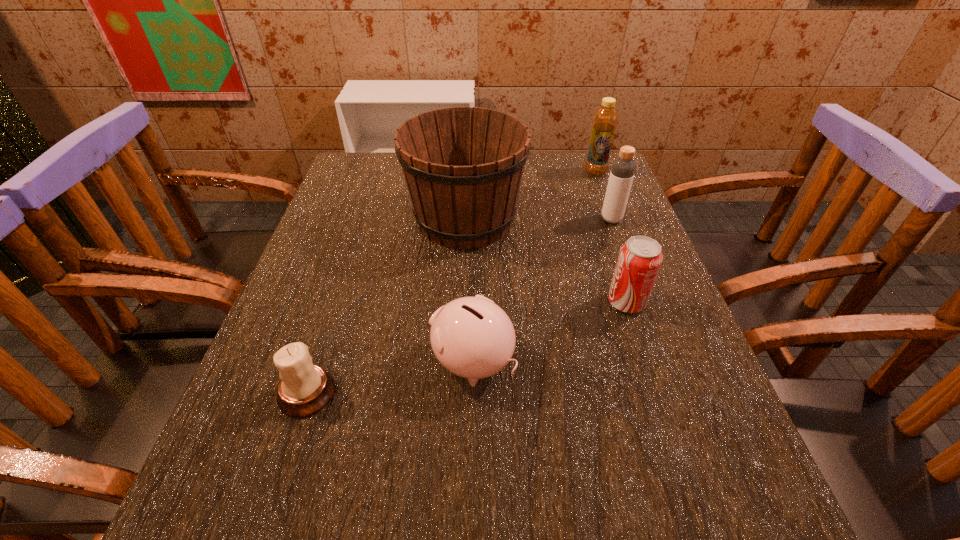
At what (x,y) coordinates should I click in order to perform the action: click on wine bucket. Please return your answer as a coordinate pair (x, y). The height and width of the screenshot is (540, 960). Looking at the image, I should click on (463, 166).

Locate an element on the screen. The height and width of the screenshot is (540, 960). the farther bottle is located at coordinates (605, 119).

You are a GUI agent. You are given a task and a screenshot of the screen. Output one action in this format:
    pyautogui.click(x=<x>, y=<y>)
    Task: Click on the nearer bottle
    The width and height of the screenshot is (960, 540).
    Given the screenshot: What is the action you would take?
    pyautogui.click(x=623, y=168)

The width and height of the screenshot is (960, 540). In order to click on soda can in this screenshot , I will do `click(640, 258)`.

Where is `piggy bank`? The image size is (960, 540). piggy bank is located at coordinates (472, 337).

At what (x,y) coordinates should I click in order to perform the action: click on candle holder. Please return your answer as a coordinate pair (x, y). The height and width of the screenshot is (540, 960). Looking at the image, I should click on (304, 389).

Locate an element on the screen. This screenshot has height=540, width=960. free point located on the right of the wine bucket is located at coordinates coord(630,219).

You are a GUI agent. You are given a task and a screenshot of the screen. Output one action in this format:
    pyautogui.click(x=<x>, y=<y>)
    Task: Click on the blank area located 0.090m on the back of the farther bottle
    Image resolution: width=960 pixels, height=540 pixels.
    Given the screenshot: What is the action you would take?
    pyautogui.click(x=588, y=152)

The image size is (960, 540). Find the location of `vacant point located on the left of the nearer bottle`. vacant point located on the left of the nearer bottle is located at coordinates (452, 219).

The width and height of the screenshot is (960, 540). In order to click on vacant area located 0.260m on the logo side of the fourth farthest object in this screenshot , I will do `click(482, 302)`.